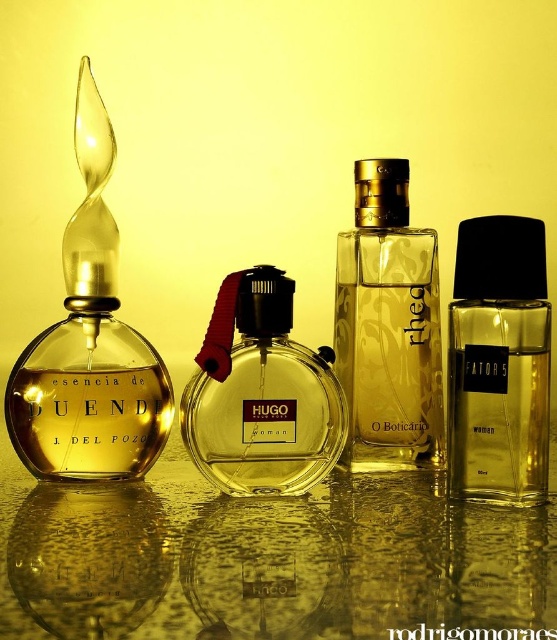
You are arranging items on a table and need to place a small vase between the transparent glass table at center and the clear glass bottle at right. Where should you place the vase?

The vase should be placed between the transparent glass table at center and the clear glass bottle at right, since the transparent glass table at center is to the left of clear glass bottle at right.